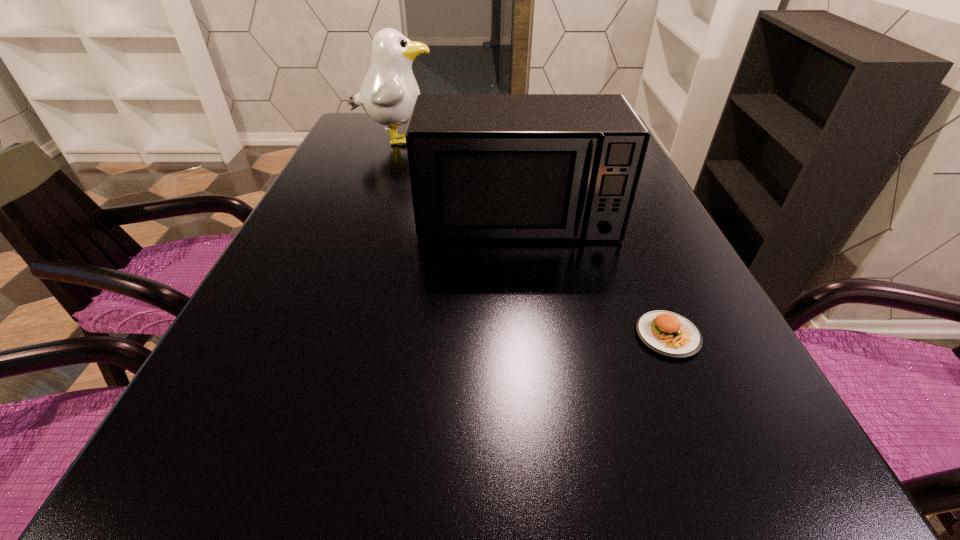
Identify which object is the closest to the second shortest object. Please provide its 2D coordinates. Your answer should be formatted as a tuple, i.e. [(x, y)], where the tuple contains the x and y coordinates of a point satisfying the conditions above.

[(667, 333)]

Where is `vacant region that satisfies the following two spatial constraints: 1. on the front-facing side of the nearest object; 2. on the left side of the second shortest object`? vacant region that satisfies the following two spatial constraints: 1. on the front-facing side of the nearest object; 2. on the left side of the second shortest object is located at coordinates (531, 335).

You are a GUI agent. You are given a task and a screenshot of the screen. Output one action in this format:
    pyautogui.click(x=<x>, y=<y>)
    Task: Click on the free space that satisfies the following two spatial constraints: 1. on the beak of the shortest object; 2. on the right side of the tallest object
    
    Given the screenshot: What is the action you would take?
    pyautogui.click(x=329, y=335)

At what (x,y) coordinates should I click in order to perform the action: click on vacant region that satisfies the following two spatial constraints: 1. on the front-facing side of the nearest object; 2. on the left side of the microwave_oven. Please return your answer as a coordinate pair (x, y). The width and height of the screenshot is (960, 540). Looking at the image, I should click on (531, 335).